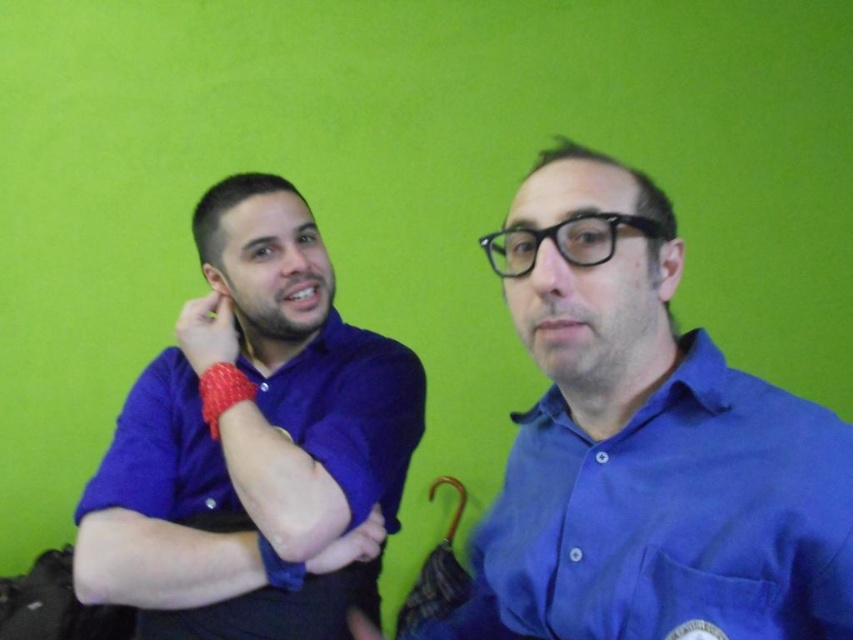
Is matte blue shirt at left smaller than rubber band at left?

No.

From the picture: How distant is matte blue shirt at left from rubber band at left?

matte blue shirt at left and rubber band at left are 4.59 inches apart.

Identify the location of matte blue shirt at left. (254, 444).

Which is above, blue cotton shirt at center or matte blue shirt at left?

matte blue shirt at left

Can you confirm if blue cotton shirt at center is thinner than matte blue shirt at left?

Indeed, blue cotton shirt at center has a lesser width compared to matte blue shirt at left.

Between point (666, 369) and point (190, 636), which one is positioned behind?

The point (190, 636) is behind.

You are a GUI agent. You are given a task and a screenshot of the screen. Output one action in this format:
    pyautogui.click(x=<x>, y=<y>)
    Task: Click on the blue cotton shirt at center
    
    Given the screenshot: What is the action you would take?
    pyautogui.click(x=648, y=456)

Between blue cotton shirt at center and rubber band at left, which one is positioned lower?

rubber band at left is below.

Does blue cotton shirt at center appear on the right side of rubber band at left?

Yes, blue cotton shirt at center is to the right of rubber band at left.

Measure the distance between point (614, 602) and camera.

27.07 inches

At what (x,y) coordinates should I click in order to perform the action: click on blue cotton shirt at center. Please return your answer as a coordinate pair (x, y). The width and height of the screenshot is (853, 640). Looking at the image, I should click on (648, 456).